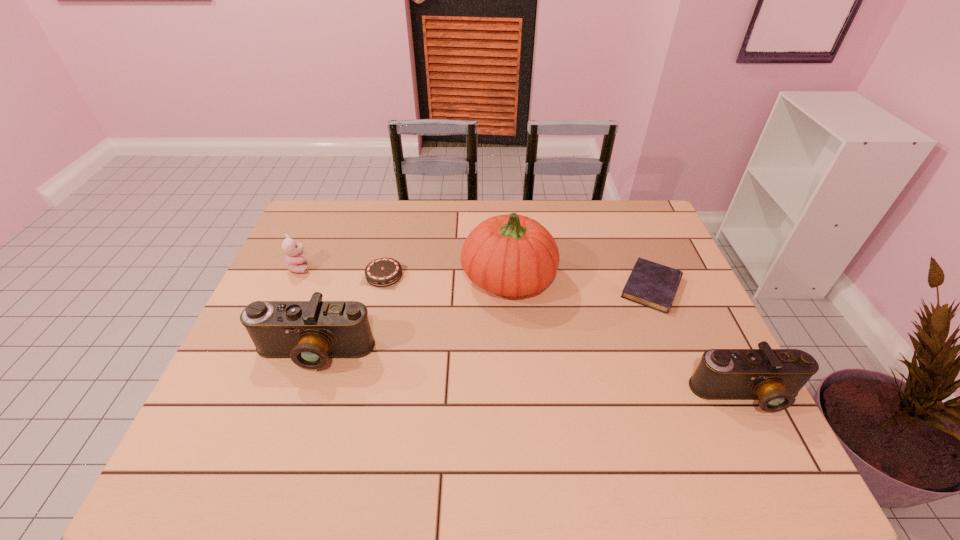
Where is `vacant area in the image that satisfies the following two spatial constraints: 1. at the face of the pumpkin; 2. on the left side of the teddy bear`? vacant area in the image that satisfies the following two spatial constraints: 1. at the face of the pumpkin; 2. on the left side of the teddy bear is located at coordinates (295, 279).